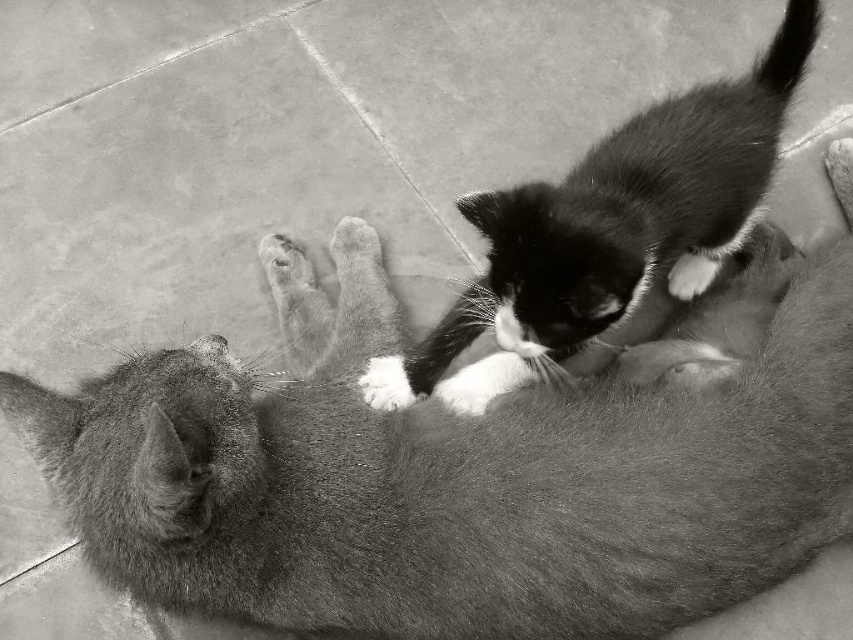
Question: Which object appears farthest from the camera in this image?

Choices:
 (A) white fur paw at upper center
 (B) soft fur kitten at center
 (C) white fur paw at center

Answer: (C)

Question: Does soft fur cat at center appear under white fluffy paw at center?

Choices:
 (A) yes
 (B) no

Answer: (B)

Question: Is soft fur cat at center further to the viewer compared to fuzzy fur paw at center?

Choices:
 (A) no
 (B) yes

Answer: (A)

Question: Which object is the farthest from the soft fur cat at center?

Choices:
 (A) fuzzy fur paw at center
 (B) white fluffy paw at center
 (C) white fur paw at upper center

Answer: (C)

Question: Is soft fur cat at center closer to the viewer compared to white fluffy paw at upper center?

Choices:
 (A) yes
 (B) no

Answer: (A)

Question: Which point is farther from the camera taking this photo?

Choices:
 (A) (695, 260)
 (B) (361, 225)

Answer: (B)